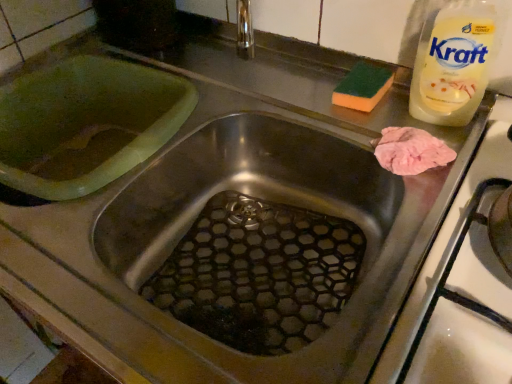
This screenshot has height=384, width=512. I want to click on vacant area situated to the left side of white plastic bottle at upper right, so click(328, 122).